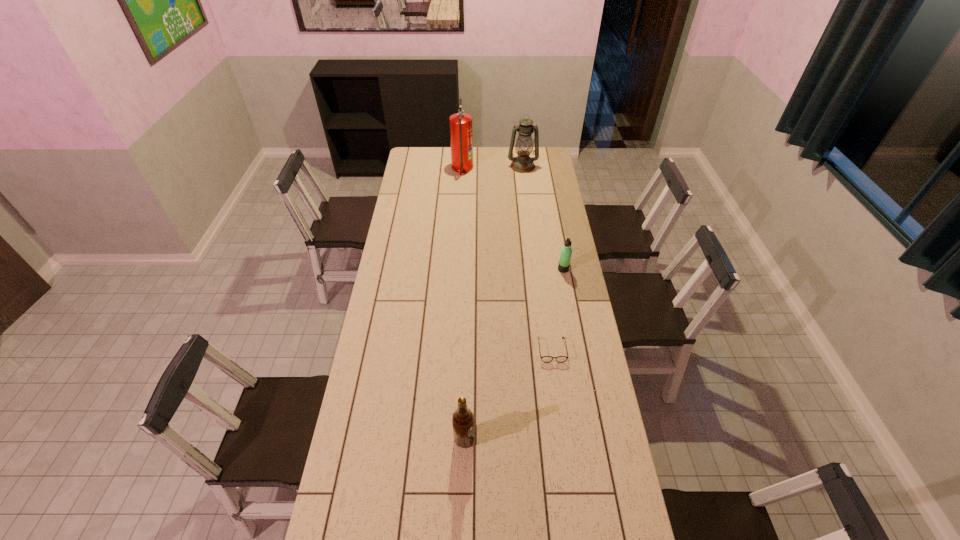
Where is `free space located 0.050m on the label of the third tallest object`? free space located 0.050m on the label of the third tallest object is located at coordinates (489, 439).

Where is `vacant point located 0.120m on the left of the fourth tallest object`? vacant point located 0.120m on the left of the fourth tallest object is located at coordinates (532, 269).

Image resolution: width=960 pixels, height=540 pixels. I want to click on vacant space located 0.370m on the front-facing side of the shortest object, so click(566, 460).

You are a GUI agent. You are given a task and a screenshot of the screen. Output one action in this format:
    pyautogui.click(x=<x>, y=<y>)
    Task: Click on the fire extinguisher that is at the far edge
    
    Given the screenshot: What is the action you would take?
    pyautogui.click(x=461, y=127)

Where is `oil lamp present at the far edge`? oil lamp present at the far edge is located at coordinates click(522, 163).

Identify the location of oil lamp that is at the right edge. This screenshot has height=540, width=960. (522, 163).

Find the location of a particular element. This screenshot has height=540, width=960. thermos bottle located in the right edge section of the desktop is located at coordinates (566, 251).

What are the coordinates of `spectacles situated at the right edge` in the screenshot? It's located at (560, 359).

I want to click on object that is positioned at the far right corner, so click(x=522, y=163).

You are a GUI agent. You are given a task and a screenshot of the screen. Output one action in this format:
    pyautogui.click(x=<x>, y=<y>)
    Task: Click on the free space at the far edge
    This screenshot has height=540, width=960.
    Given the screenshot: What is the action you would take?
    pyautogui.click(x=484, y=166)